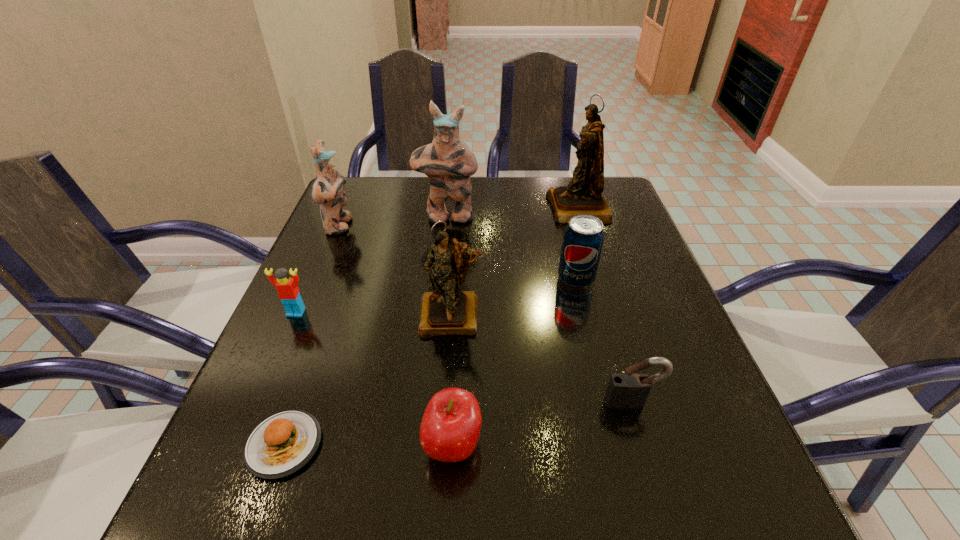
Identify the location of soda can at the right edge. This screenshot has width=960, height=540. (583, 238).

Locate an element on the screen. This screenshot has width=960, height=540. padlock that is at the right edge is located at coordinates (629, 390).

You are a GUI agent. You are given a task and a screenshot of the screen. Output one action in this format:
    pyautogui.click(x=<x>, y=<y>)
    Task: Click on the object at the far left corner
    
    Given the screenshot: What is the action you would take?
    pyautogui.click(x=327, y=191)

Identify the location of object that is at the near left corner. Image resolution: width=960 pixels, height=540 pixels. (283, 443).

In order to click on object that is at the far right corner in this screenshot , I will do `click(583, 195)`.

I want to click on free space at the far edge, so click(421, 207).

Where is `free space at the near edge of the desktop`? free space at the near edge of the desktop is located at coordinates (344, 519).

Where is `free space at the left edge of the desktop`? This screenshot has width=960, height=540. free space at the left edge of the desktop is located at coordinates tap(369, 237).

Image resolution: width=960 pixels, height=540 pixels. I want to click on free space at the right edge of the desktop, so click(x=675, y=341).

In the image, there is a desktop. Where is `vacant space at the far left corner`? This screenshot has width=960, height=540. vacant space at the far left corner is located at coordinates [x=390, y=210].